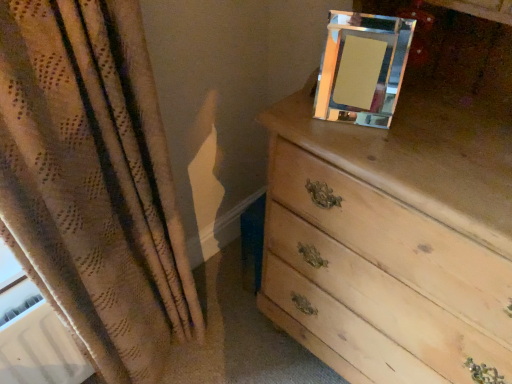
Question: Considering the relative sizes of light wood chest of drawers at upper right and clear glass picture frame at upper right in the image provided, is light wood chest of drawers at upper right shorter than clear glass picture frame at upper right?

Choices:
 (A) yes
 (B) no

Answer: (B)

Question: Does light wood chest of drawers at upper right have a larger size compared to clear glass picture frame at upper right?

Choices:
 (A) yes
 (B) no

Answer: (A)

Question: Are light wood chest of drawers at upper right and clear glass picture frame at upper right located far from each other?

Choices:
 (A) no
 (B) yes

Answer: (A)

Question: Is light wood chest of drawers at upper right taller than clear glass picture frame at upper right?

Choices:
 (A) yes
 (B) no

Answer: (A)

Question: Considering the relative sizes of light wood chest of drawers at upper right and clear glass picture frame at upper right in the image provided, is light wood chest of drawers at upper right smaller than clear glass picture frame at upper right?

Choices:
 (A) no
 (B) yes

Answer: (A)

Question: From a real-world perspective, is light wood chest of drawers at upper right physically below clear glass picture frame at upper right?

Choices:
 (A) yes
 (B) no

Answer: (A)

Question: Can you confirm if clear glass picture frame at upper right is wider than light wood chest of drawers at upper right?

Choices:
 (A) yes
 (B) no

Answer: (B)

Question: From the image's perspective, is clear glass picture frame at upper right over light wood chest of drawers at upper right?

Choices:
 (A) no
 (B) yes

Answer: (B)

Question: Considering the relative sizes of clear glass picture frame at upper right and light wood chest of drawers at upper right in the image provided, is clear glass picture frame at upper right thinner than light wood chest of drawers at upper right?

Choices:
 (A) no
 (B) yes

Answer: (B)

Question: From the image's perspective, is clear glass picture frame at upper right below light wood chest of drawers at upper right?

Choices:
 (A) yes
 (B) no

Answer: (B)

Question: Is light wood chest of drawers at upper right surrounded by clear glass picture frame at upper right?

Choices:
 (A) no
 (B) yes

Answer: (A)

Question: Can you confirm if clear glass picture frame at upper right is shorter than light wood chest of drawers at upper right?

Choices:
 (A) yes
 (B) no

Answer: (A)

Question: From the image's perspective, relative to clear glass picture frame at upper right, is light wood chest of drawers at upper right above or below?

Choices:
 (A) above
 (B) below

Answer: (B)